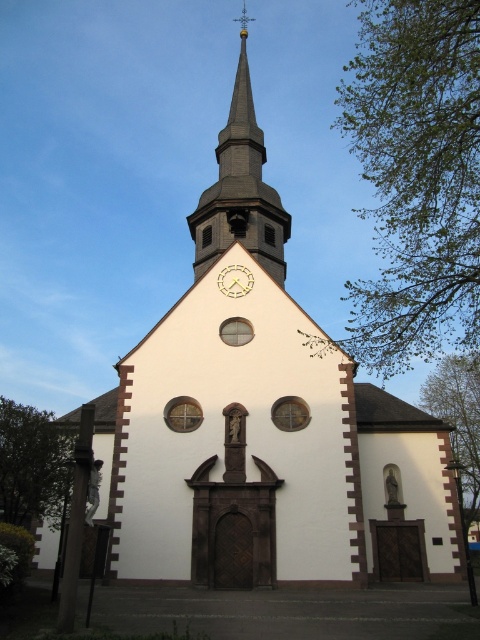
You are standing in front of the church and want to take a photo of the gold metallic clock at center without the smooth gray steeple at upper center blocking it. Is this possible?

The gold metallic clock at center is behind the smooth gray steeple at upper center, so it would be blocked by the steeple and not visible in the photo.

structural analysis of the church steeple at point (240, 188)

The point (240, 188) corresponds to the smooth gray steeple at upper center, which is constructed from dark brown bricks and features a clock with golden hands and numbers embedded in its upper section.

You are a drone operator tasked with capturing aerial footage of the church. Your drone has a maximum flight range of 30 meters. You need to fly from the smooth gray steeple at upper center to the gold metallic clock at center. Can your drone complete this flight without exceeding its range?

The smooth gray steeple at upper center and gold metallic clock at center are 29.55 meters apart from each other. Since the drone has a maximum flight range of 30 meters, it can complete the flight without exceeding its range.